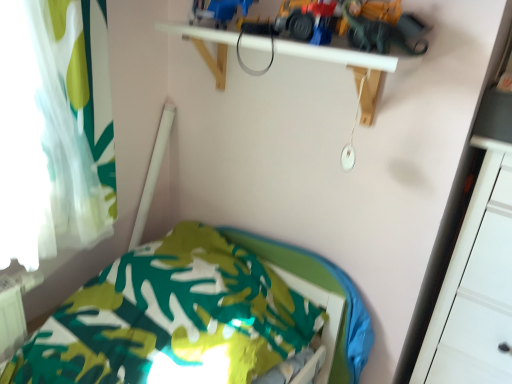
Question: Is white sheer curtain at left touching blue plastic toy truck at upper center, the second toy in the right-to-left sequence?

Choices:
 (A) yes
 (B) no

Answer: (B)

Question: Can you confirm if white sheer curtain at left is smaller than blue plastic toy truck at upper center, the 1th toy positioned from the left?

Choices:
 (A) no
 (B) yes

Answer: (A)

Question: From the image's perspective, is white sheer curtain at left located beneath blue plastic toy truck at upper center, the 1th toy positioned from the left?

Choices:
 (A) yes
 (B) no

Answer: (A)

Question: Does white sheer curtain at left have a lesser height compared to blue plastic toy truck at upper center, the 1th toy positioned from the left?

Choices:
 (A) no
 (B) yes

Answer: (A)

Question: Would you say blue plastic toy truck at upper center, the second toy in the right-to-left sequence, is part of white sheer curtain at left's contents?

Choices:
 (A) no
 (B) yes

Answer: (A)

Question: Is green fabric bed at lower left to the left or to the right of matte red toy car at upper center, the 1th toy car positioned from the left, in the image?

Choices:
 (A) right
 (B) left

Answer: (B)

Question: Considering the positions of point (52, 365) and point (312, 36), is point (52, 365) closer or farther from the camera than point (312, 36)?

Choices:
 (A) farther
 (B) closer

Answer: (A)

Question: Considering the positions of green fabric bed at lower left and matte red toy car at upper center, the 1th toy car positioned from the left, in the image, is green fabric bed at lower left wider or thinner than matte red toy car at upper center, the 1th toy car positioned from the left,?

Choices:
 (A) thin
 (B) wide

Answer: (B)

Question: Considering their positions, is green fabric bed at lower left located in front of or behind matte red toy car at upper center, the 2th toy car viewed from the right?

Choices:
 (A) behind
 (B) front

Answer: (B)

Question: In terms of width, does yellow plastic toy car at upper center, arranged as the first toy car when viewed from the right, look wider or thinner when compared to matte red toy car at upper center, the 2th toy car viewed from the right?

Choices:
 (A) thin
 (B) wide

Answer: (A)

Question: Is yellow plastic toy car at upper center, arranged as the first toy car when viewed from the right, inside or outside of matte red toy car at upper center, the 2th toy car viewed from the right?

Choices:
 (A) inside
 (B) outside

Answer: (B)

Question: Relative to matte red toy car at upper center, the 2th toy car viewed from the right, is yellow plastic toy car at upper center, arranged as the first toy car when viewed from the right, in front or behind?

Choices:
 (A) behind
 (B) front

Answer: (B)

Question: From the image's perspective, is yellow plastic toy car at upper center, arranged as the first toy car when viewed from the right, located above or below matte red toy car at upper center, the 1th toy car positioned from the left?

Choices:
 (A) below
 (B) above

Answer: (A)

Question: From the image's perspective, is yellow plastic toy car at upper center, placed as the second toy car when sorted from left to right, located above or below blue plastic toy truck at upper center, the 1th toy positioned from the left?

Choices:
 (A) below
 (B) above

Answer: (A)

Question: In the image, is yellow plastic toy car at upper center, arranged as the first toy car when viewed from the right, on the left side or the right side of blue plastic toy truck at upper center, the 1th toy positioned from the left?

Choices:
 (A) left
 (B) right

Answer: (B)